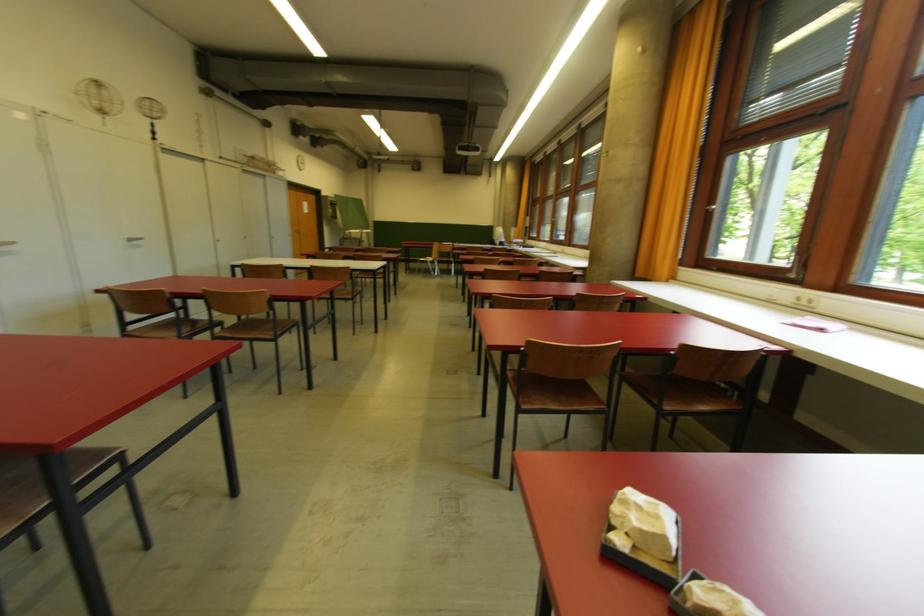
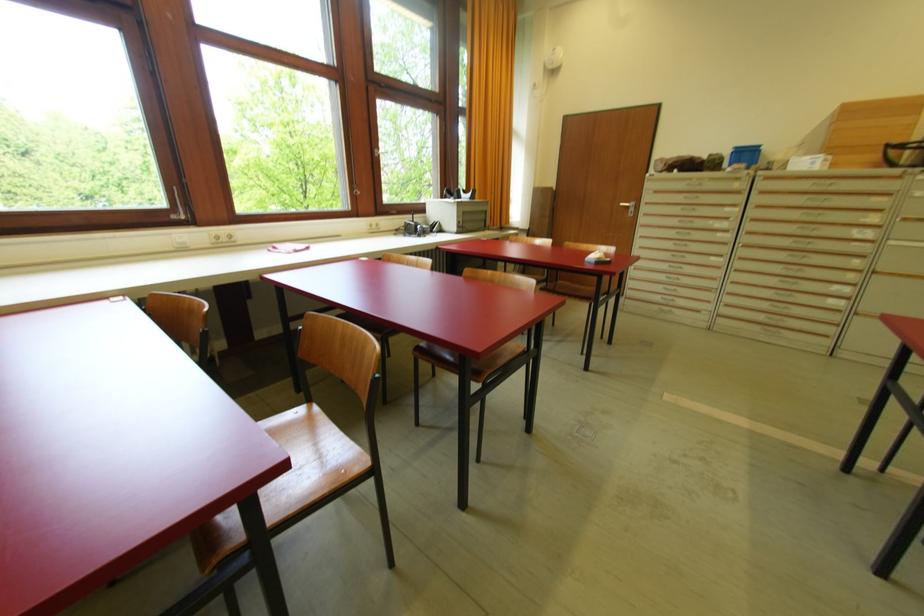
Where in the second image is the point corresponding to point 795,278 from the first image?

(186, 219)